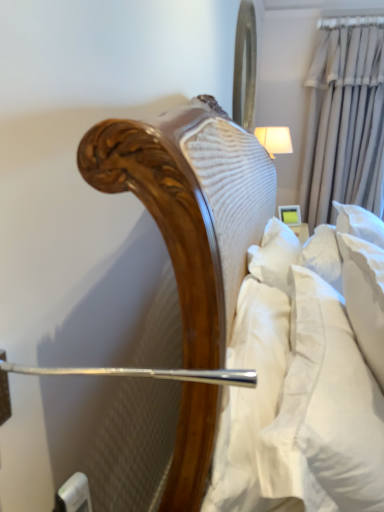
Question: In terms of width, does metallic reflective mirror at upper center look wider or thinner when compared to beige fabric curtain at upper right?

Choices:
 (A) wide
 (B) thin

Answer: (B)

Question: Based on their sizes in the image, would you say metallic reflective mirror at upper center is bigger or smaller than beige fabric curtain at upper right?

Choices:
 (A) small
 (B) big

Answer: (A)

Question: Estimate the real-world distances between objects in this image. Which object is farther from the beige fabric curtain at upper right?

Choices:
 (A) white soft pillow at right
 (B) white fabric lampshade at upper right
 (C) metallic reflective mirror at upper center

Answer: (A)

Question: Estimate the real-world distances between objects in this image. Which object is closer to the white fabric lampshade at upper right?

Choices:
 (A) metallic reflective mirror at upper center
 (B) white soft pillow at right
 (C) beige fabric curtain at upper right

Answer: (A)